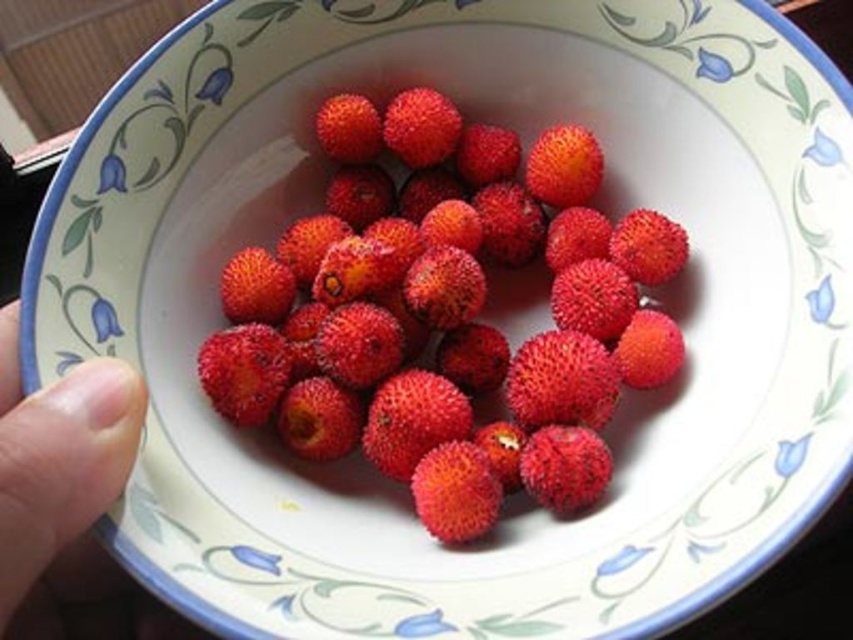
You are a chef preparing a fruit platter and need to know if the spongy red berries at center will fit in a container that can only hold items narrower than the smooth skin finger at lower left. Can they fit?

The spongy red berries at center might be wider than the smooth skin finger at lower left, so they may not fit in the container if the container can only hold items narrower than the finger.